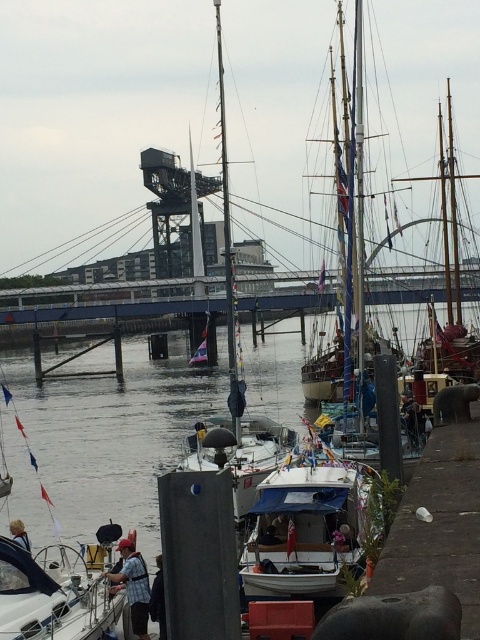
You are a dock worker trying to fit a new boat into the space between the white matte boat at center and the wooden sailboat at center. Based on their widths, can you determine if there is enough space for the new boat?

The white matte boat at center might be wider than wooden sailboat at center, so there might not be enough space for the new boat unless the gap between them accommodates the new boat.